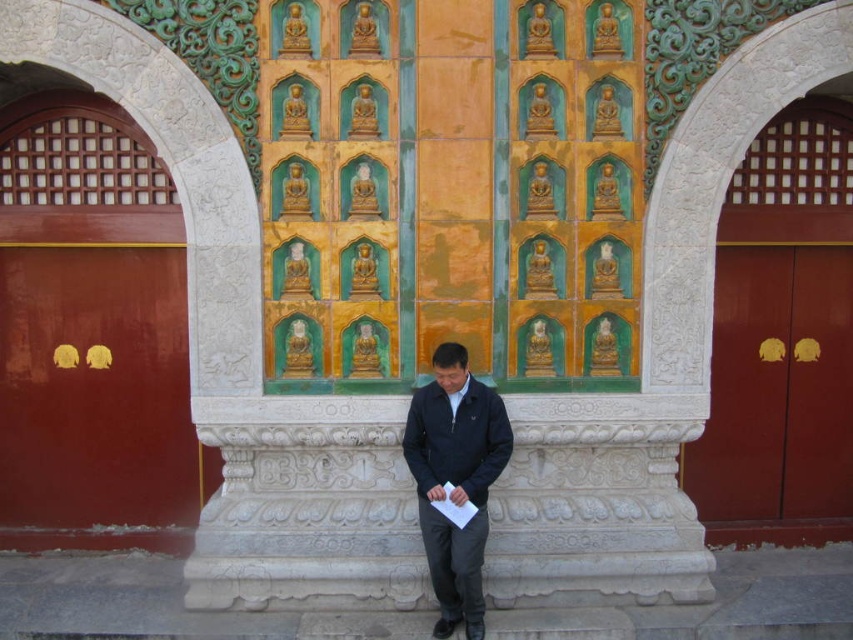
Is point (39, 429) closer to camera compared to point (776, 305)?

Yes, point (39, 429) is in front of point (776, 305).

The width and height of the screenshot is (853, 640). What are the coordinates of `smooth red wood door at left` in the screenshot? It's located at (96, 388).

Is point (96, 371) closer to viewer compared to point (766, 289)?

That is True.

You are a GUI agent. You are given a task and a screenshot of the screen. Output one action in this format:
    pyautogui.click(x=<x>, y=<y>)
    Task: Click on the smooth red wood door at left
    The height and width of the screenshot is (640, 853).
    Given the screenshot: What is the action you would take?
    pyautogui.click(x=96, y=388)

Consider the image. Who is taller, smooth red wood door at left or dark blue jacket at center?

smooth red wood door at left is taller.

In the scene shown: Is smooth red wood door at left to the left of dark blue jacket at center from the viewer's perspective?

Indeed, smooth red wood door at left is positioned on the left side of dark blue jacket at center.

Who is more forward, (177, 349) or (466, 611)?

Point (466, 611) is more forward.

The width and height of the screenshot is (853, 640). In order to click on smooth red wood door at left in this screenshot , I will do `click(96, 388)`.

Find the location of a particular element. The width and height of the screenshot is (853, 640). matte wood door at right is located at coordinates (776, 387).